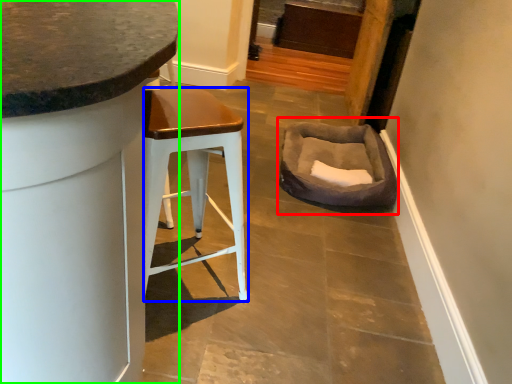
Question: Based on their relative distances, which object is nearer to bean bag chair (highlighted by a red box)? Choose from stool (highlighted by a blue box) and cabinetry (highlighted by a green box).

Choices:
 (A) stool
 (B) cabinetry

Answer: (A)